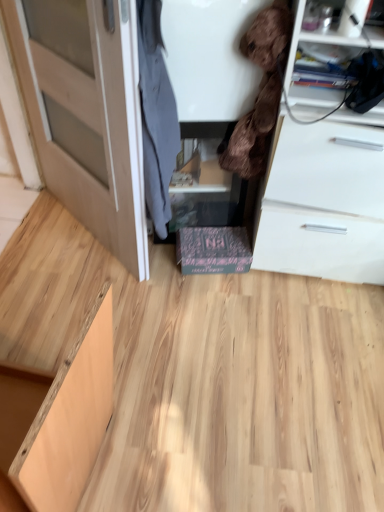
At what (x,y) coordinates should I click in order to perform the action: click on vacant area located to the right-hand side of light wood cabinet at lower left, which is the second cabinetry from right to left. Please return your answer as a coordinate pair (x, y). The width and height of the screenshot is (384, 512). Looking at the image, I should click on (183, 431).